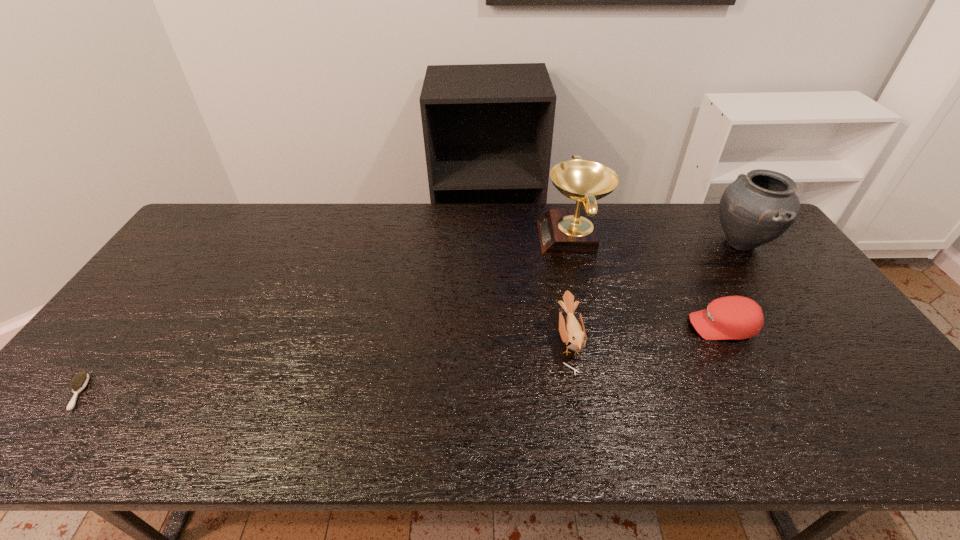
Where is `vacant space that satisfies the following two spatial constraints: 1. on the front-facing side of the rightmost object; 2. on the right side of the award`? vacant space that satisfies the following two spatial constraints: 1. on the front-facing side of the rightmost object; 2. on the right side of the award is located at coordinates (573, 242).